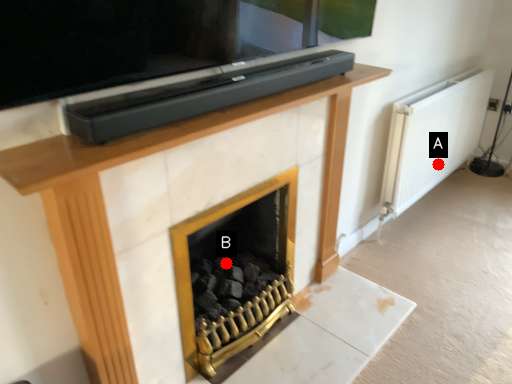
Question: Two points are circled on the image, labeled by A and B beside each circle. Which point is further to the camera?

Choices:
 (A) A is further
 (B) B is further

Answer: (A)